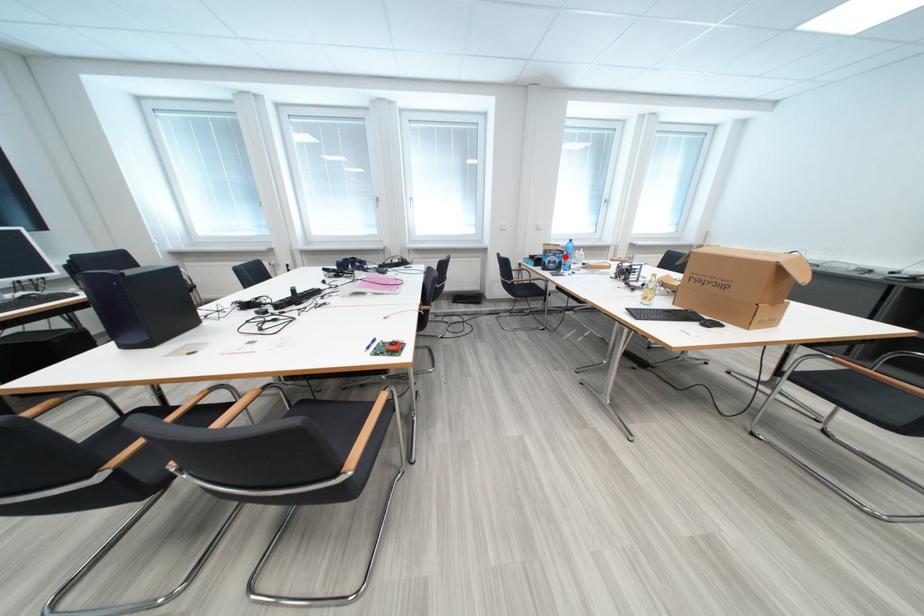
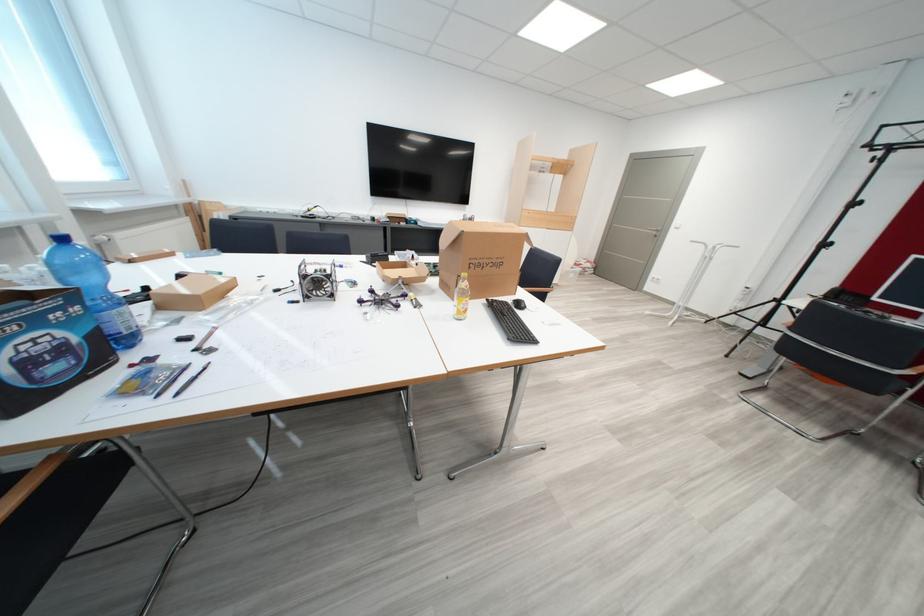
Find the pixel in the second image that matches the highlighted location in the first image.

(46, 323)